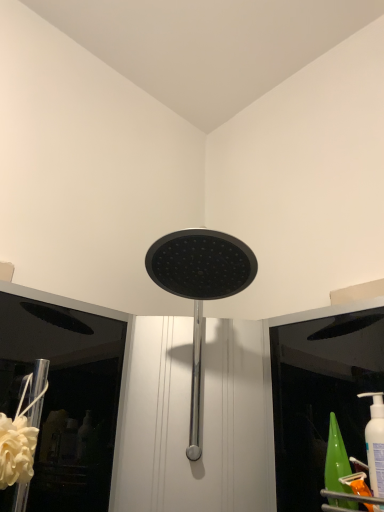
Question: Considering their positions, is black matte shower head at center located in front of or behind white matte flower at lower left?

Choices:
 (A) behind
 (B) front

Answer: (B)

Question: Considering the positions of point (162, 279) and point (14, 437), is point (162, 279) closer or farther from the camera than point (14, 437)?

Choices:
 (A) closer
 (B) farther

Answer: (B)

Question: Is black matte shower head at center wider or thinner than white matte flower at lower left?

Choices:
 (A) wide
 (B) thin

Answer: (A)

Question: From the image's perspective, relative to black matte shower head at center, is white matte flower at lower left above or below?

Choices:
 (A) below
 (B) above

Answer: (A)

Question: From a real-world perspective, is white matte flower at lower left above or below black matte shower head at center?

Choices:
 (A) below
 (B) above

Answer: (A)

Question: Based on their positions, is white matte flower at lower left located to the left or right of black matte shower head at center?

Choices:
 (A) left
 (B) right

Answer: (A)

Question: Does point (28, 426) appear closer or farther from the camera than point (165, 278)?

Choices:
 (A) closer
 (B) farther

Answer: (A)